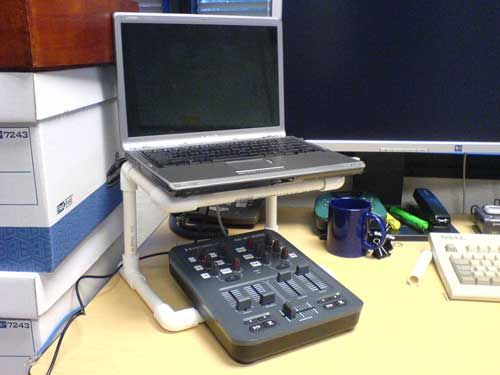
You are a GUI agent. You are given a task and a screenshot of the screen. Output one action in this format:
    pyautogui.click(x=<x>, y=<y>)
    Task: Click on the stapler
    
    Given the screenshot: What is the action you would take?
    pyautogui.click(x=433, y=208)